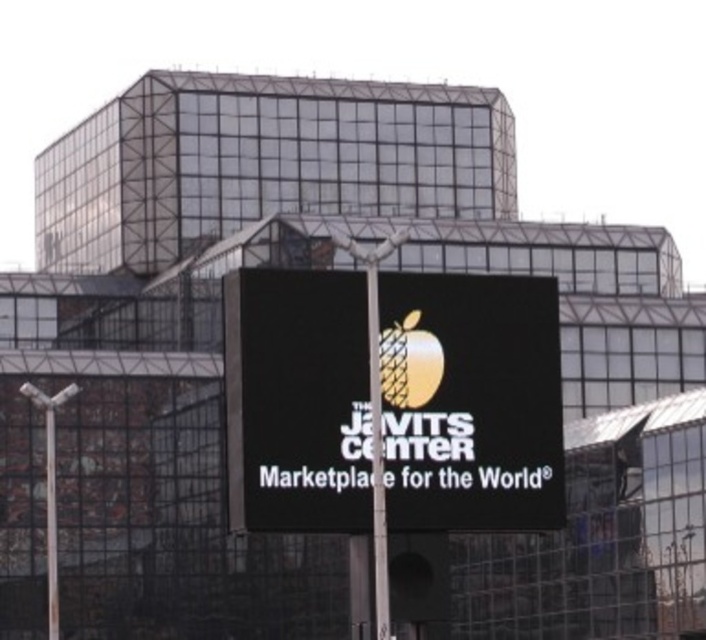
Does black digital sign at center come in front of metallic pole at center?

No, it is not.

Can you confirm if black digital sign at center is smaller than metallic pole at center?

No.

Between point (309, 328) and point (388, 579), which one is positioned in front?

Point (388, 579) is more forward.

In order to click on black digital sign at center in this screenshot , I will do `click(469, 403)`.